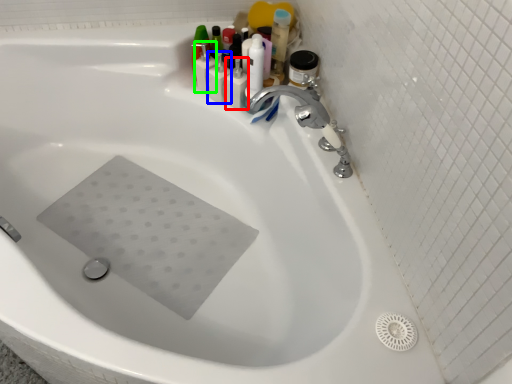
Question: Based on their relative distances, which object is farther from toiletry (highlighted by a red box)? Choose from toiletry (highlighted by a blue box) and toiletry (highlighted by a green box).

Choices:
 (A) toiletry
 (B) toiletry

Answer: (B)